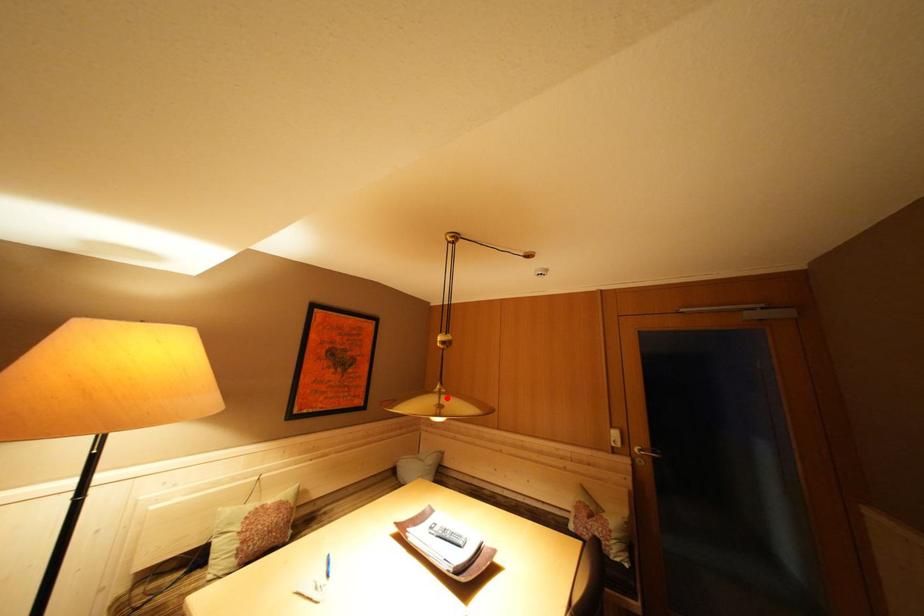
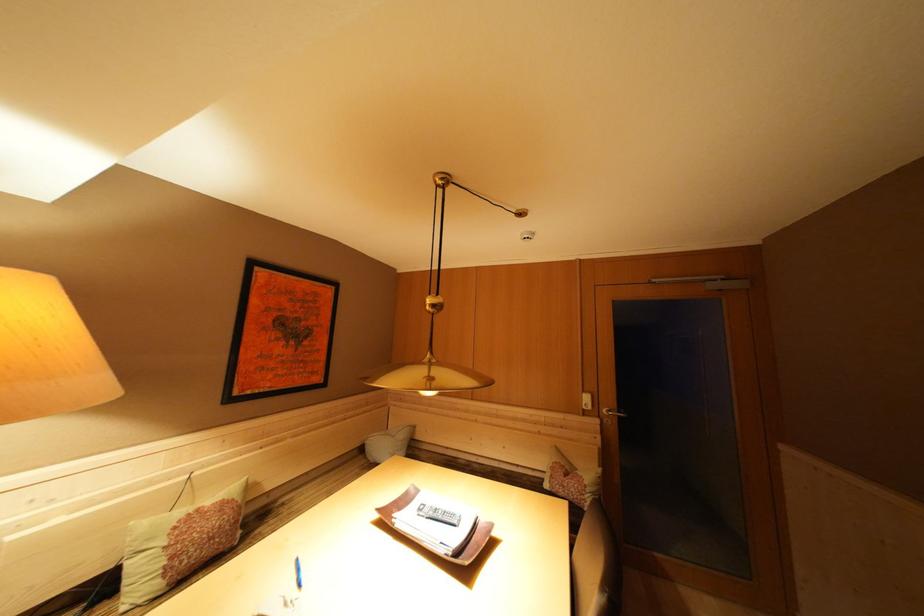
Where in the second image is the point corresponding to the highlighted location from the first image?

(438, 369)